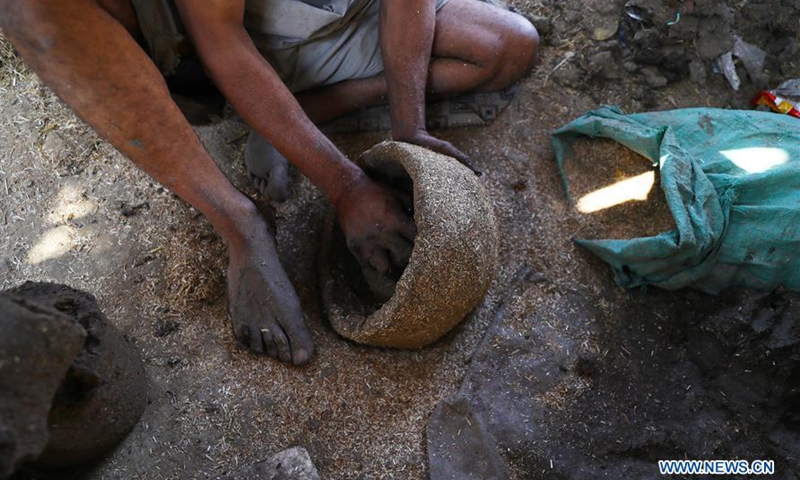
The image size is (800, 480). I want to click on light spots, so click(757, 160), click(625, 194), click(56, 248), click(72, 207).